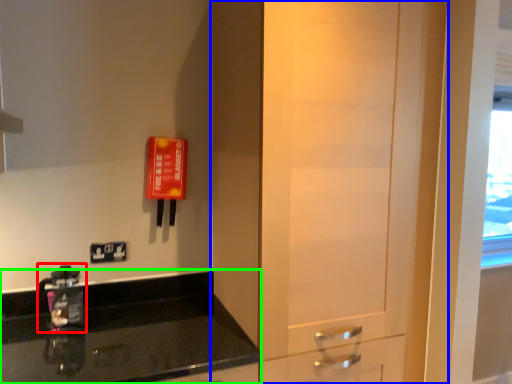
Question: Which object is positioned closest to appliance (highlighted by a red box)? Select from door (highlighted by a blue box) and countertop (highlighted by a green box).

Choices:
 (A) door
 (B) countertop

Answer: (B)